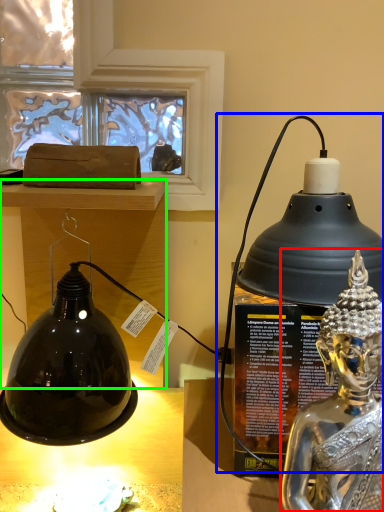
Question: Based on their relative distances, which object is nearer to person (highlighted by a red box)? Choose from oil lamp (highlighted by a blue box) and furniture (highlighted by a green box).

Choices:
 (A) oil lamp
 (B) furniture

Answer: (A)